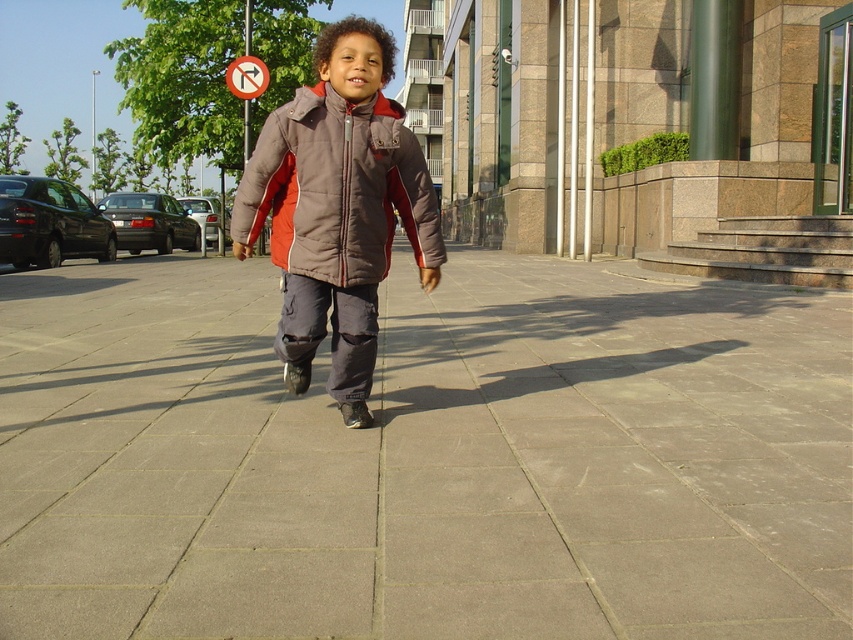
Question: Among these points, which one is farthest from the camera?

Choices:
 (A) (314, 65)
 (B) (103, 632)

Answer: (A)

Question: Which object is farther from the camera taking this photo?

Choices:
 (A) gray concrete pavement at center
 (B) brown puffy jacket at center

Answer: (B)

Question: Can you confirm if gray concrete pavement at center is smaller than brown puffy jacket at center?

Choices:
 (A) no
 (B) yes

Answer: (B)

Question: Observing the image, what is the correct spatial positioning of gray concrete pavement at center in reference to brown puffy jacket at center?

Choices:
 (A) right
 (B) left

Answer: (A)

Question: Does gray concrete pavement at center have a smaller size compared to brown puffy jacket at center?

Choices:
 (A) no
 (B) yes

Answer: (B)

Question: Which of the following is the closest to the observer?

Choices:
 (A) gray concrete pavement at center
 (B) brown puffy jacket at center

Answer: (A)